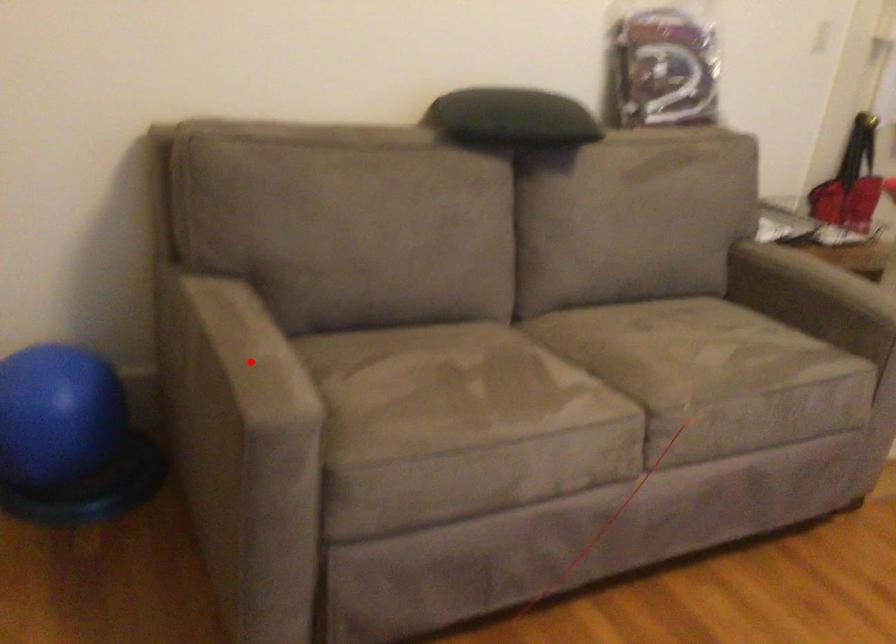
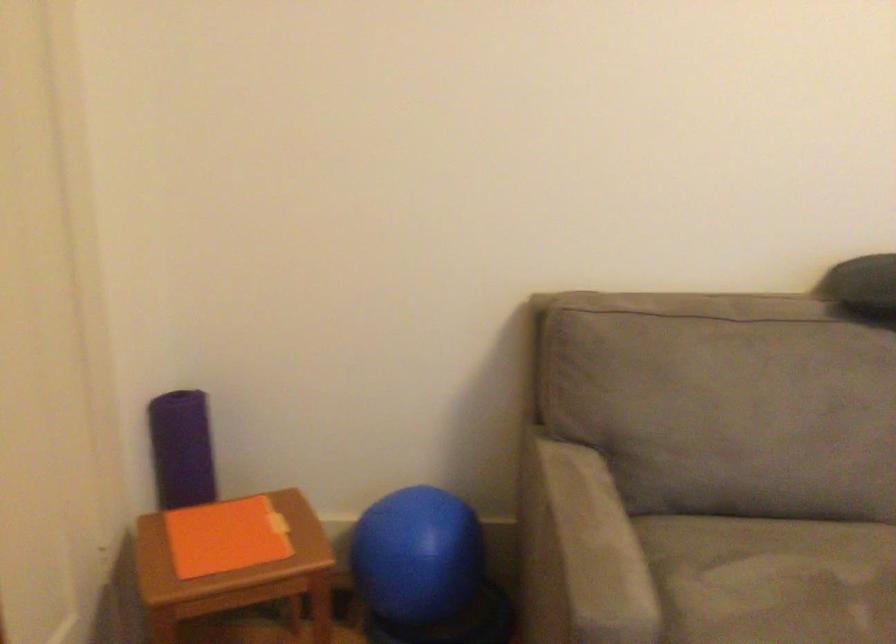
The point at the highlighted location is marked in the first image. Where is the corresponding point in the second image?

(588, 550)